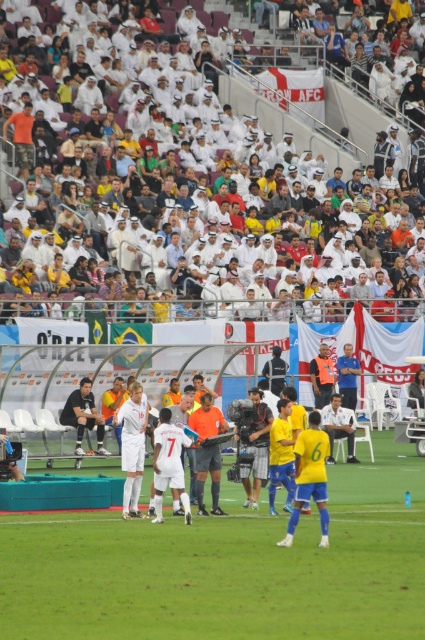
Is point (76, 392) positioned behind point (331, 458)?

No, it is in front of (331, 458).

Is dark gray jersey at center in front of white fabric shirt at center?

Yes, it is in front of white fabric shirt at center.

Which is behind, point (79, 396) or point (348, 451)?

The point (348, 451) is behind.

What are the coordinates of `dark gray jersey at center` in the screenshot? It's located at (84, 416).

Who is shorter, white fabric crowd at upper center or white fabric shirt at center?

white fabric shirt at center is shorter.

This screenshot has height=640, width=425. Find the location of `white fabric crowd at upper center`. white fabric crowd at upper center is located at coordinates (292, 124).

Find the location of a particular element. Image resolution: width=425 pixels, height=640 pixels. white fabric crowd at upper center is located at coordinates (292, 124).

Describe the element at coordinates (84, 416) in the screenshot. I see `dark gray jersey at center` at that location.

Between point (62, 420) and point (328, 365), which one is positioned behind?

Point (328, 365)

In order to click on dark gray jersey at center in this screenshot , I will do `click(84, 416)`.

You are a GUI agent. You are given a task and a screenshot of the screen. Output one action in this format:
    pyautogui.click(x=<x>, y=<y>)
    Task: Click on the dark gray jersey at center
    
    Given the screenshot: What is the action you would take?
    [84, 416]